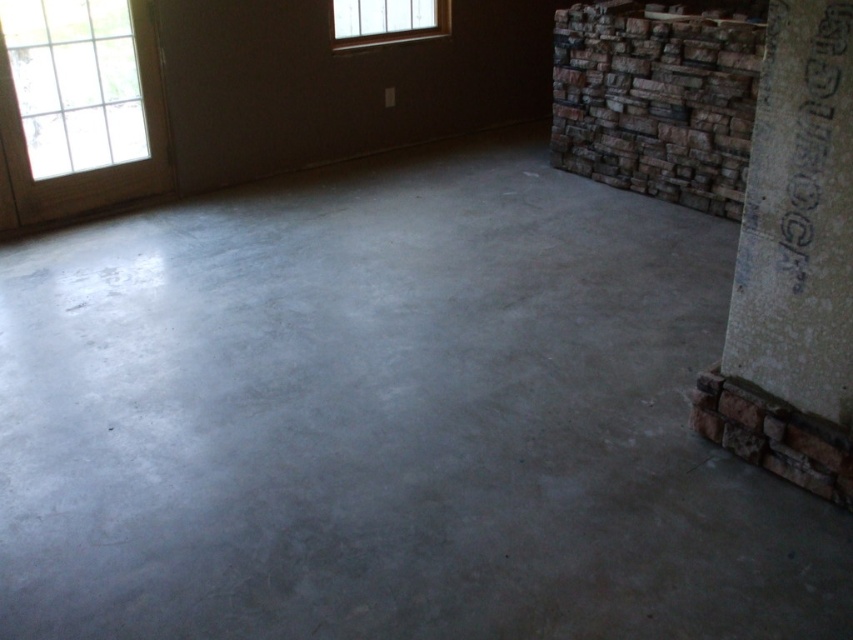
Question: Estimate the real-world distances between objects in this image. Which object is closer to the clear glass window at upper center?

Choices:
 (A) white concrete pillar at right
 (B) clear glass window at upper left

Answer: (B)

Question: Does white concrete pillar at right have a lesser width compared to clear glass window at upper left?

Choices:
 (A) no
 (B) yes

Answer: (B)

Question: Does clear glass window at upper left appear on the right side of clear glass window at upper center?

Choices:
 (A) no
 (B) yes

Answer: (A)

Question: Which point appears closest to the camera in this image?

Choices:
 (A) (68, 116)
 (B) (368, 29)
 (C) (782, 396)

Answer: (C)

Question: Which point is farther to the camera?

Choices:
 (A) clear glass window at upper center
 (B) white concrete pillar at right
 (C) clear glass window at upper left

Answer: (A)

Question: Can you confirm if white concrete pillar at right is wider than clear glass window at upper center?

Choices:
 (A) yes
 (B) no

Answer: (B)